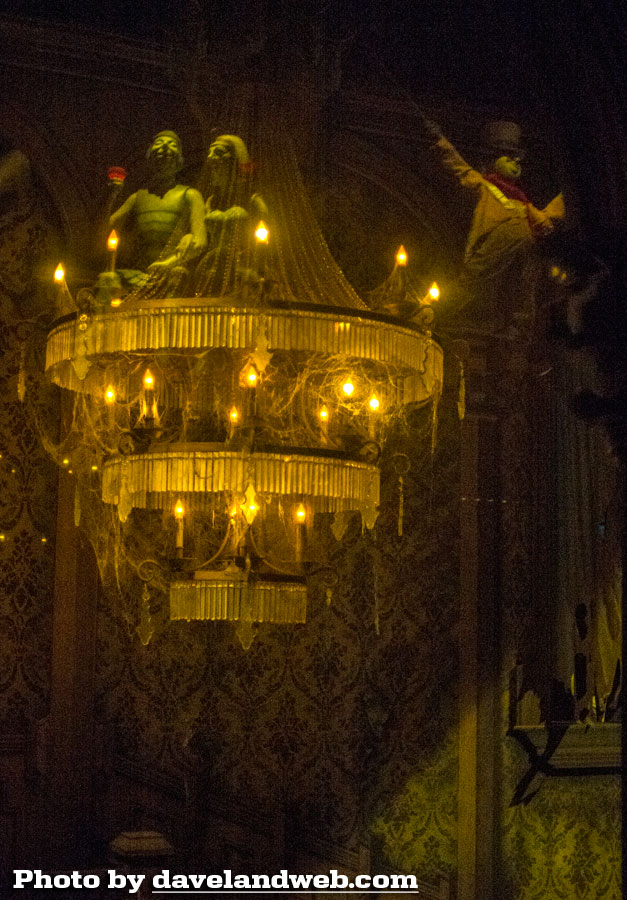
Locate an element on the screen. The height and width of the screenshot is (900, 627). curtain is located at coordinates (604, 654).